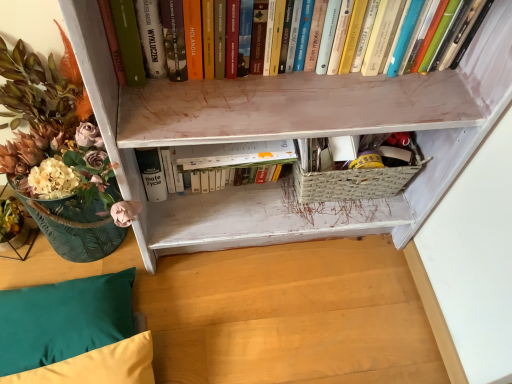
What do you see at coordinates (98, 366) in the screenshot? I see `velvet yellow pillow at lower left, placed as the first pillow when sorted from bottom to top` at bounding box center [98, 366].

The image size is (512, 384). In order to click on hardcover books at upper center, which is the second book from back to front in this screenshot , I will do `click(113, 41)`.

You are a GUI agent. You are given a task and a screenshot of the screen. Output one action in this format:
    pyautogui.click(x=<x>, y=<y>)
    Task: Click on the translucent glass vase at left
    Image resolution: width=512 pixels, height=384 pixels.
    Given the screenshot: What is the action you would take?
    pyautogui.click(x=58, y=151)

From the image's perspective, between translucent glass vase at left and velvet yellow pillow at lower left, placed as the first pillow when sorted from bottom to top, who is located below?

velvet yellow pillow at lower left, placed as the first pillow when sorted from bottom to top, is shown below in the image.

Does translucent glass vase at left come in front of velvet yellow pillow at lower left, placed as the 2th pillow when sorted from top to bottom?

That is True.

Considering the relative positions of translucent glass vase at left and velvet yellow pillow at lower left, placed as the 2th pillow when sorted from top to bottom, in the image provided, is translucent glass vase at left to the right of velvet yellow pillow at lower left, placed as the 2th pillow when sorted from top to bottom, from the viewer's perspective?

No.

Does translucent glass vase at left appear on the right side of teal fabric pillow at lower left, placed as the 2th pillow when sorted from bottom to top?

Correct, you'll find translucent glass vase at left to the right of teal fabric pillow at lower left, placed as the 2th pillow when sorted from bottom to top.

Between translucent glass vase at left and teal fabric pillow at lower left, the first pillow viewed from the top, which one has larger width?

With larger width is translucent glass vase at left.

Identify the location of floral arrangement in front of the teal fabric pillow at lower left, the first pillow viewed from the top. (58, 151).

Can you see translucent glass vase at left touching teal fabric pillow at lower left, placed as the 2th pillow when sorted from bottom to top?

No, translucent glass vase at left is not next to teal fabric pillow at lower left, placed as the 2th pillow when sorted from bottom to top.

Is teal fabric pillow at lower left, placed as the 2th pillow when sorted from bottom to top, completely or partially inside woven straw basket at lower center?

That's incorrect, teal fabric pillow at lower left, placed as the 2th pillow when sorted from bottom to top, is not inside woven straw basket at lower center.

Is woven straw basket at lower center positioned with its back to teal fabric pillow at lower left, placed as the 2th pillow when sorted from bottom to top?

woven straw basket at lower center is not turned away from teal fabric pillow at lower left, placed as the 2th pillow when sorted from bottom to top.

Locate an element on the screen. This screenshot has width=512, height=384. pillow that is the 1st one when counting forward from the woven straw basket at lower center is located at coordinates (64, 320).

Would you say woven straw basket at lower center is a long distance from teal fabric pillow at lower left, placed as the 2th pillow when sorted from bottom to top?

No, woven straw basket at lower center is in close proximity to teal fabric pillow at lower left, placed as the 2th pillow when sorted from bottom to top.

From the image's perspective, who appears lower, woven straw basket at lower center or hardcover books at upper center, which is the second book from back to front?

woven straw basket at lower center appears lower in the image.

Which is farther, (370,182) or (459,55)?

The point (370,182) is farther from the camera.

Is woven straw basket at lower center touching hardcover books at upper center, which is the second book from back to front?

No, woven straw basket at lower center is not next to hardcover books at upper center, which is the second book from back to front.

Considering the sizes of objects woven straw basket at lower center and hardcover books at upper center, the 1th book viewed from the top, in the image provided, who is smaller, woven straw basket at lower center or hardcover books at upper center, the 1th book viewed from the top,?

With smaller size is woven straw basket at lower center.

Between translucent glass vase at left and woven straw basket at lower center, which one has less height?

woven straw basket at lower center.

Considering the relative sizes of translucent glass vase at left and woven straw basket at lower center in the image provided, is translucent glass vase at left bigger than woven straw basket at lower center?

Yes, translucent glass vase at left is bigger than woven straw basket at lower center.

Consider the image. From the image's perspective, is translucent glass vase at left located above or below woven straw basket at lower center?

Based on their image positions, translucent glass vase at left is located beneath woven straw basket at lower center.

Is translucent glass vase at left at the right side of woven straw basket at lower center?

Incorrect, translucent glass vase at left is not on the right side of woven straw basket at lower center.

Which book is the 2nd one when counting from the left side of the woven straw basket at lower center? Please provide its 2D coordinates.

[(225, 157)]

Is woven straw basket at lower center at the back of white matte book at center, the 1th book from the back?

No.

Which of these two, white matte book at center, the 1th book from the back, or woven straw basket at lower center, stands shorter?

Standing shorter between the two is woven straw basket at lower center.

Is white matte book at center, the first book ordered from the bottom, positioned before woven straw basket at lower center?

Yes.

Is teal fabric pillow at lower left, placed as the 2th pillow when sorted from bottom to top, smaller than white matte book at center, the 1th book from the back?

Incorrect, teal fabric pillow at lower left, placed as the 2th pillow when sorted from bottom to top, is not smaller in size than white matte book at center, the 1th book from the back.

Which is in front, point (82, 303) or point (205, 161)?

Positioned in front is point (205, 161).

Is teal fabric pillow at lower left, the first pillow viewed from the top, wider than white matte book at center, which is the 2th book from top to bottom?

Indeed, teal fabric pillow at lower left, the first pillow viewed from the top, has a greater width compared to white matte book at center, which is the 2th book from top to bottom.

From the image's perspective, who appears lower, teal fabric pillow at lower left, placed as the 2th pillow when sorted from bottom to top, or white matte book at center, which is the 2th book from top to bottom?

From the image's view, teal fabric pillow at lower left, placed as the 2th pillow when sorted from bottom to top, is below.

At what (x,y) coordinates should I click in order to perform the action: click on pillow on the right of translucent glass vase at left. Please return your answer as a coordinate pair (x, y). Looking at the image, I should click on (98, 366).

At what (x,y) coordinates should I click in order to perform the action: click on the 2nd pillow behind when counting from the translucent glass vase at left. Please return your answer as a coordinate pair (x, y). The height and width of the screenshot is (384, 512). Looking at the image, I should click on (64, 320).

From the image, which object appears to be farther from teal fabric pillow at lower left, the first pillow viewed from the top, white matte book at center, which ranks as the 2th book in front-to-back order, or hardcover books at upper center, the 1th book viewed from the top?

hardcover books at upper center, the 1th book viewed from the top, is further to teal fabric pillow at lower left, the first pillow viewed from the top.

Estimate the real-world distances between objects in this image. Which object is closer to velvet yellow pillow at lower left, placed as the first pillow when sorted from bottom to top, translucent glass vase at left or woven straw basket at lower center?

The object closer to velvet yellow pillow at lower left, placed as the first pillow when sorted from bottom to top, is translucent glass vase at left.

Looking at this image, considering their positions, is woven straw basket at lower center positioned closer to teal fabric pillow at lower left, placed as the 2th pillow when sorted from bottom to top, than hardcover books at upper center, which is the second book from back to front?

Based on the image, hardcover books at upper center, which is the second book from back to front, appears to be nearer to teal fabric pillow at lower left, placed as the 2th pillow when sorted from bottom to top.

Which object lies nearer to the anchor point velvet yellow pillow at lower left, placed as the 2th pillow when sorted from top to bottom, woven straw basket at lower center or teal fabric pillow at lower left, the first pillow viewed from the top?

teal fabric pillow at lower left, the first pillow viewed from the top, is closer to velvet yellow pillow at lower left, placed as the 2th pillow when sorted from top to bottom.

Which object lies nearer to the anchor point hardcover books at upper center, the 1th book viewed from the top, woven straw basket at lower center or white matte book at center, which is the 2th book from top to bottom?

white matte book at center, which is the 2th book from top to bottom, lies closer to hardcover books at upper center, the 1th book viewed from the top, than the other object.

Looking at this image, when comparing their distances from velvet yellow pillow at lower left, placed as the 2th pillow when sorted from top to bottom, does white matte book at center, the 1th book from the back, or woven straw basket at lower center seem further?

Among the two, woven straw basket at lower center is located further to velvet yellow pillow at lower left, placed as the 2th pillow when sorted from top to bottom.

When comparing their distances from hardcover books at upper center, placed as the 1th book when sorted from front to back, does woven straw basket at lower center or velvet yellow pillow at lower left, placed as the 2th pillow when sorted from top to bottom, seem closer?

Answer: Based on the image, woven straw basket at lower center appears to be nearer to hardcover books at upper center, placed as the 1th book when sorted from front to back.

Considering their positions, is teal fabric pillow at lower left, placed as the 2th pillow when sorted from bottom to top, positioned further to woven straw basket at lower center than translucent glass vase at left?

Among the two, teal fabric pillow at lower left, placed as the 2th pillow when sorted from bottom to top, is located further to woven straw basket at lower center.

Locate an element on the screen. Image resolution: width=512 pixels, height=384 pixels. pillow between hardcover books at upper center, which is the second book from back to front, and velvet yellow pillow at lower left, placed as the first pillow when sorted from bottom to top, from top to bottom is located at coordinates (64, 320).

Find the location of a particular element. This screenshot has width=512, height=384. pillow between white matte book at center, which ranks as the 2th book in front-to-back order, and velvet yellow pillow at lower left, placed as the 2th pillow when sorted from top to bottom, vertically is located at coordinates (64, 320).

The height and width of the screenshot is (384, 512). I want to click on book between hardcover books at upper center, the 1th book viewed from the top, and woven straw basket at lower center from front to back, so click(x=225, y=157).

The image size is (512, 384). I want to click on pillow between translucent glass vase at left and velvet yellow pillow at lower left, placed as the 2th pillow when sorted from top to bottom, vertically, so click(x=64, y=320).